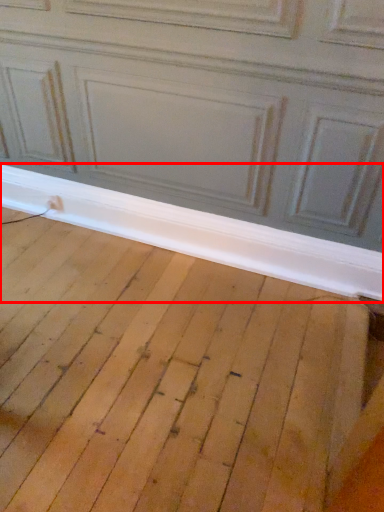
Question: From the image, what is the correct spatial relationship of window sill (annotated by the red box) in relation to plywood?

Choices:
 (A) left
 (B) right

Answer: (B)